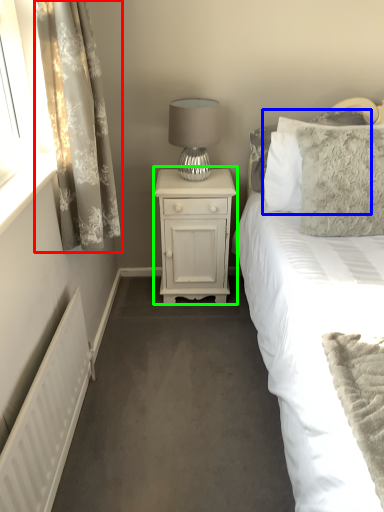
Question: Which object is the closest to the curtain (highlighted by a red box)? Choose among these: pillow (highlighted by a blue box) or nightstand (highlighted by a green box).

Choices:
 (A) pillow
 (B) nightstand

Answer: (B)